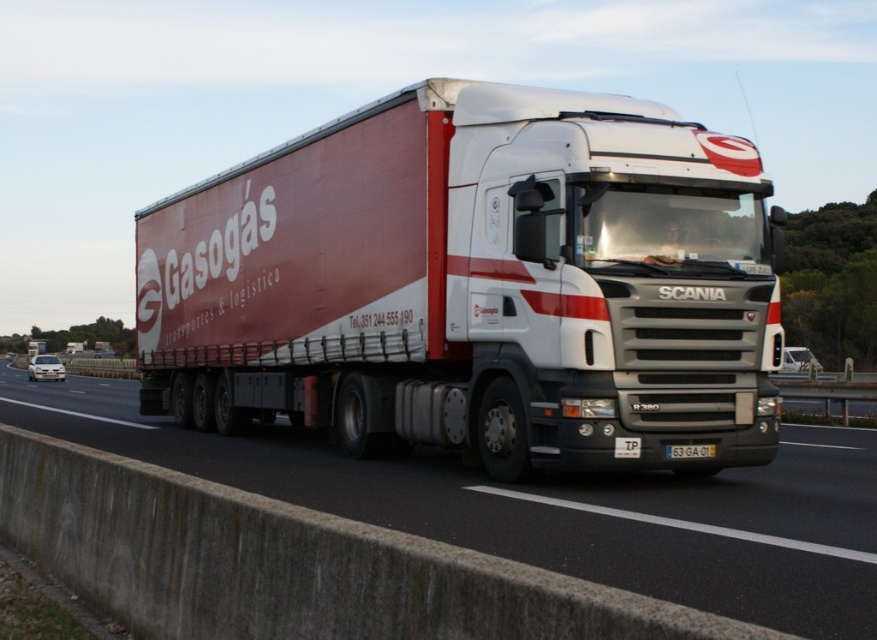
You are a delivery driver who needs to attach a new license plate to your Gasogas truck. The current white plastic license plate at center and yellow plastic license plate at center are already mounted. How far apart are these two plates?

The distance between the white plastic license plate at center and the yellow plastic license plate at center is 56.39 centimeters.

You are a traffic officer standing next to a camera that is facing the Gasogas truck. The camera is supposed to capture the white plastic license plate at center of the truck. Given that the camera has a maximum effective range of 30 feet, will the camera be able to clearly capture the license plate?

The distance between the white plastic license plate at center and the camera is 28.11 feet, which is within the camera maximum effective range of 30 feet. Therefore, the camera will be able to clearly capture the license plate.

You are a delivery driver who needs to enter a tunnel with a height restriction of 3 meters. You see the white glossy truck at center and the white plastic license plate at center in your vehicle. Based on their sizes, can you estimate if your truck will fit through the tunnel?

The white glossy truck at center is much taller than the white plastic license plate at center, so it is likely that the truck exceeds the 3 meter height restriction and may not fit through the tunnel.